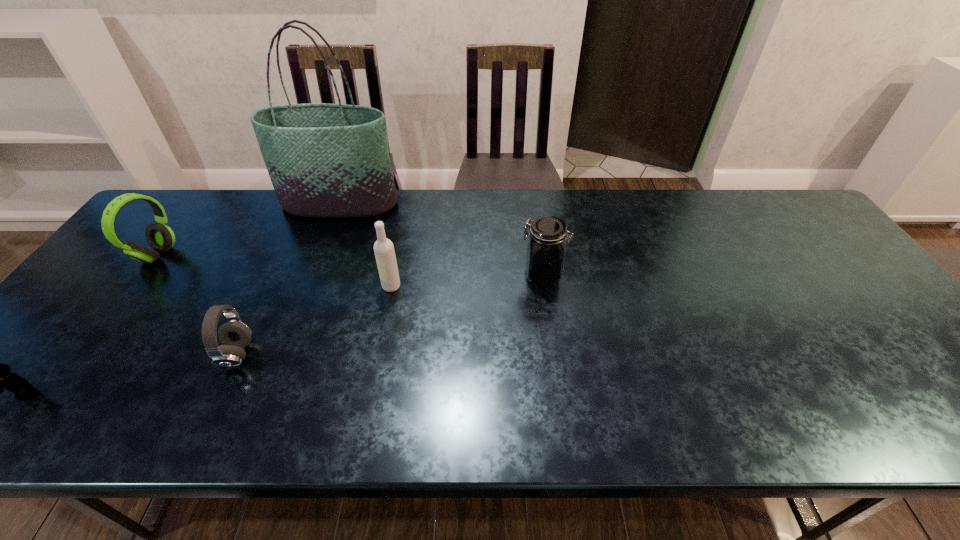
Identify the location of empty space between the left headset and the Lego. (92, 325).

What are the coordinates of `vacant space that is in between the rightmost object and the tote bag` in the screenshot? It's located at coord(441,239).

The width and height of the screenshot is (960, 540). I want to click on vacant space that is in between the second object from right to left and the farther headset, so click(275, 271).

The height and width of the screenshot is (540, 960). I want to click on vacant area between the fifth tallest object and the tote bag, so click(289, 279).

Find the location of a particular element. empty location between the fifth object from left to right and the farther headset is located at coordinates (275, 271).

I want to click on free area in between the tallest object and the second shortest object, so click(289, 279).

I want to click on the fourth closest object relative to the jar, so pos(160,237).

Identify the location of object that ranks as the second closest to the taller headset. (234, 335).

You are a GUI agent. You are given a task and a screenshot of the screen. Output one action in this format:
    pyautogui.click(x=<x>, y=<y>)
    Task: Click on the blank area in the image that satisfies the following two spatial constraints: 1. on the lid of the jar; 2. on the front side of the vodka
    
    Given the screenshot: What is the action you would take?
    pyautogui.click(x=544, y=286)